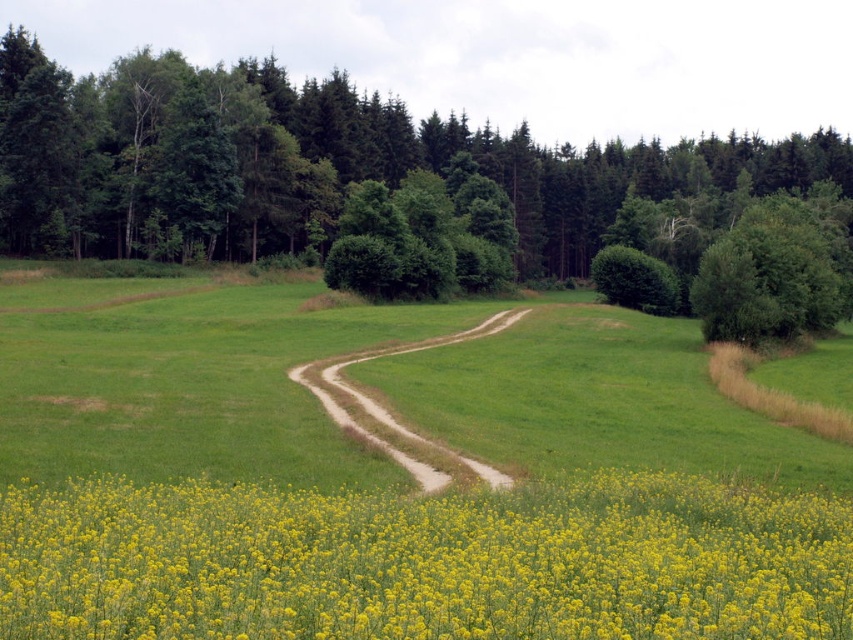
Which is behind, point (6, 72) or point (738, 292)?

The point (6, 72) is behind.

Can you confirm if green leafy tree at center is positioned below green leafy bush at upper right?

No, green leafy tree at center is not below green leafy bush at upper right.

Is point (585, 196) more distant than point (811, 291)?

Yes, it is.

This screenshot has height=640, width=853. I want to click on green leafy tree at center, so click(x=316, y=164).

Between green leafy tree at center and brown dirt trail at center, which one appears on the right side from the viewer's perspective?

From the viewer's perspective, green leafy tree at center appears more on the right side.

Between point (260, 154) and point (372, 428), which one is positioned behind?

Positioned behind is point (260, 154).

Between point (315, 145) and point (396, 460), which one is positioned in front?

Positioned in front is point (396, 460).

At what (x,y) coordinates should I click in order to perform the action: click on green leafy tree at center. Please return your answer as a coordinate pair (x, y). Looking at the image, I should click on (316, 164).

Which is above, yellow soft-textured flowers at bottom or green leafy bush at upper right?

green leafy bush at upper right

The height and width of the screenshot is (640, 853). What do you see at coordinates (425, 561) in the screenshot?
I see `yellow soft-textured flowers at bottom` at bounding box center [425, 561].

Is point (39, 632) positioned after point (815, 330)?

No, it is not.

This screenshot has height=640, width=853. Identify the location of yellow soft-textured flowers at bottom. (425, 561).